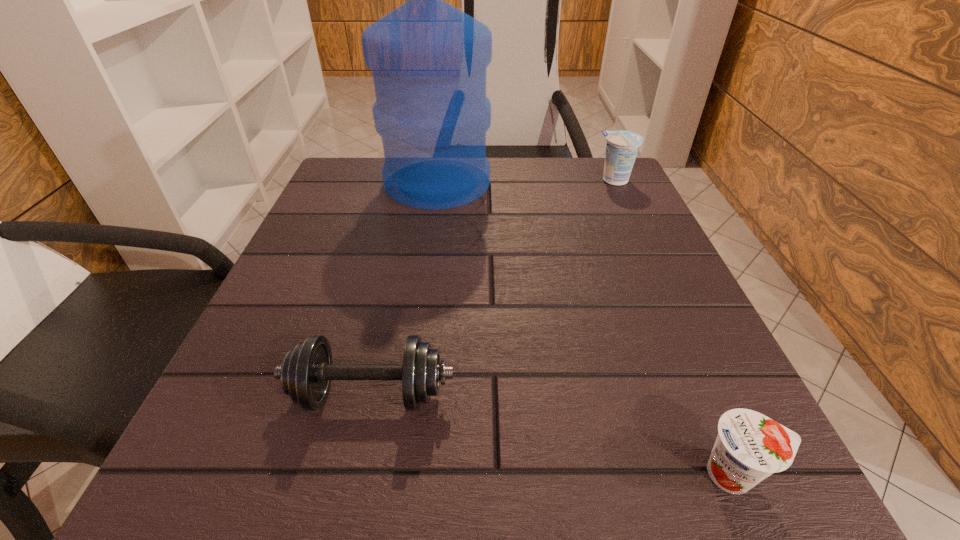
Identify the location of the tallest object. (429, 60).

Identify the location of the farther yogurt. (622, 147).

Find the location of a particular element. The height and width of the screenshot is (540, 960). dumbbell is located at coordinates (307, 371).

Find the location of `the shortest object`. the shortest object is located at coordinates (749, 447).

This screenshot has width=960, height=540. I want to click on the nearer yogurt, so click(x=749, y=447).

The width and height of the screenshot is (960, 540). I want to click on free region located on the front of the water jug, so (430, 234).

Where is `blank space located on the left of the farther yogurt`? The image size is (960, 540). blank space located on the left of the farther yogurt is located at coordinates (532, 180).

Find the location of a particular element. free space located on the back of the dumbbell is located at coordinates (385, 328).

Identify the location of vacant space located 0.070m on the back of the nearest object. The width and height of the screenshot is (960, 540). (700, 394).

This screenshot has width=960, height=540. Identify the location of water jug that is at the far edge. (429, 60).